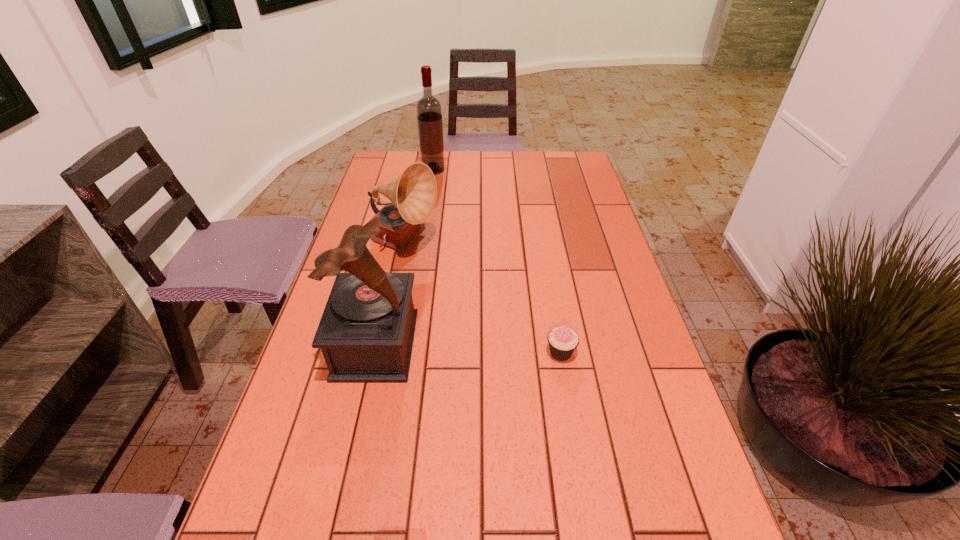
I want to click on object present at the far edge, so pyautogui.click(x=429, y=112).

This screenshot has width=960, height=540. I want to click on vacant space at the far edge, so click(x=535, y=178).

Identify the location of free location at the left edge. This screenshot has width=960, height=540. (297, 477).

The width and height of the screenshot is (960, 540). What are the coordinates of `blank area at the right edge` in the screenshot? It's located at (592, 250).

Locate an element on the screen. This screenshot has height=540, width=960. vacant area at the far right corner is located at coordinates (582, 175).

The width and height of the screenshot is (960, 540). I want to click on free space between the nearer phonograph record and the shortest object, so click(468, 348).

The width and height of the screenshot is (960, 540). I want to click on free area in between the taller phonograph record and the shortest object, so click(468, 348).

Where is `vacant area between the farthest object and the shortest object`? The image size is (960, 540). vacant area between the farthest object and the shortest object is located at coordinates (497, 261).

You are a GUI agent. You are given a task and a screenshot of the screen. Output one action in this format:
    pyautogui.click(x=<x>, y=<y>)
    Task: Click on the empty location between the nearer phonograph record and the rightmost object
    
    Given the screenshot: What is the action you would take?
    pyautogui.click(x=468, y=348)

Locate an element on the screen. This screenshot has height=540, width=960. free space between the nearer phonograph record and the wine bottle is located at coordinates (405, 258).